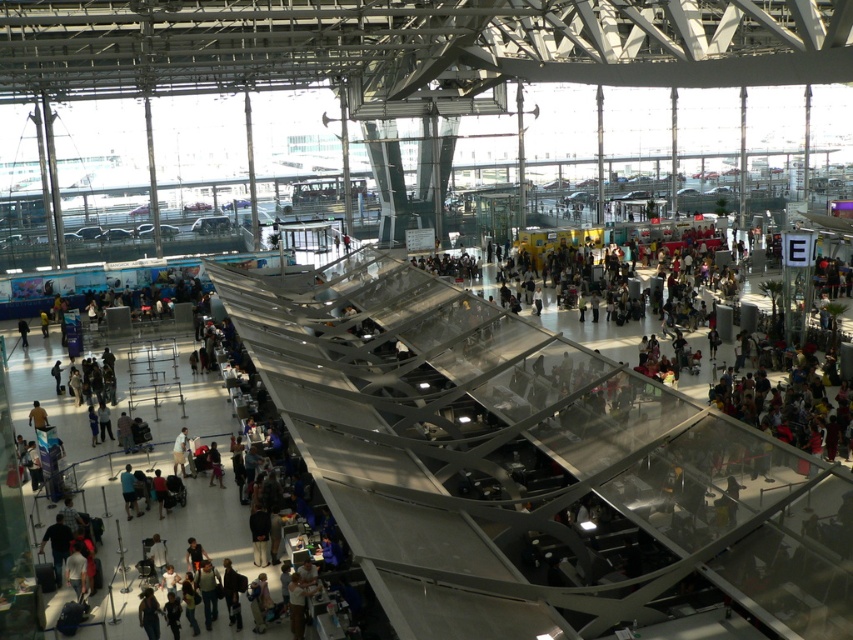
You are a photographer standing in the airport terminal. You want to take a photo of the dark blue shirt at center and the light brown fabric pants at center. However, you need to ensure that both subjects are fully visible in the frame. Based on their positions, which subject should you focus on first to ensure both are in the shot?

The dark blue shirt at center is behind light brown fabric pants at center, so you should focus on the light brown fabric pants at center first to ensure both are visible in the frame.

You are standing at the entrance of the airport terminal and want to reach the point marked as point (178,442). Given that your walking speed is 3 feet per second, how many seconds will it take you to reach that point?

The distance between you and point (178,442) is 113.77 feet. At a walking speed of 3 feet per second, it will take approximately 37.9 seconds to reach the point.